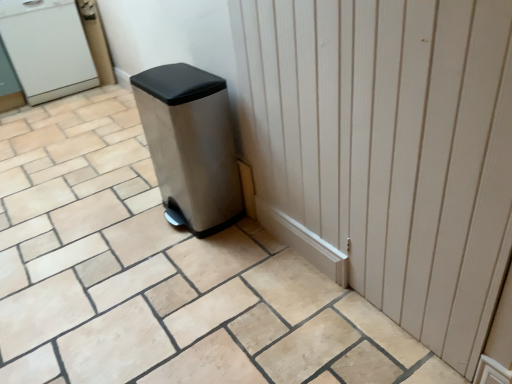
Question: From the image's perspective, is white matte water cooler at upper left above or below white wood door at center?

Choices:
 (A) below
 (B) above

Answer: (B)

Question: Considering the positions of white matte water cooler at upper left and white wood door at center in the image, is white matte water cooler at upper left taller or shorter than white wood door at center?

Choices:
 (A) short
 (B) tall

Answer: (A)

Question: Based on their relative distances, which object is farther from the beige ceramic tile at center?

Choices:
 (A) white matte water cooler at upper left
 (B) white wood door at center
 (C) stainless steel trash can at center

Answer: (A)

Question: Estimate the real-world distances between objects in this image. Which object is farther from the white wood door at center?

Choices:
 (A) stainless steel trash can at center
 (B) white matte water cooler at upper left
 (C) beige ceramic tile at center

Answer: (B)